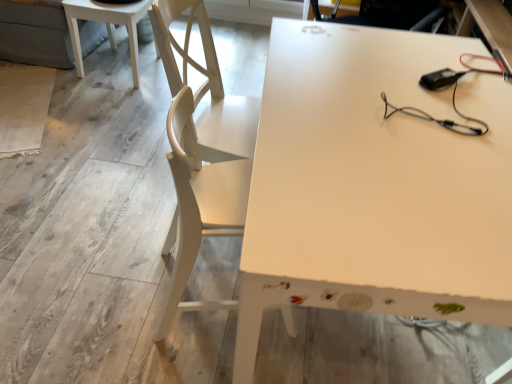
The image size is (512, 384). I want to click on free space to the left of white wood chair at left, so click(x=109, y=277).